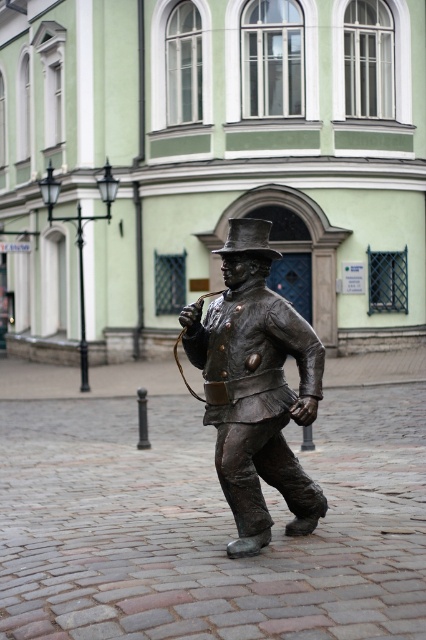
Is point (245, 506) farther from viewer compared to point (229, 241)?

No, it is in front of (229, 241).

Can you confirm if bronze statue at center is bigger than shiny bronze hat at center?

Actually, bronze statue at center might be smaller than shiny bronze hat at center.

What do you see at coordinates (256, 387) in the screenshot? I see `bronze statue at center` at bounding box center [256, 387].

Locate an element on the screen. The image size is (426, 640). bronze statue at center is located at coordinates (256, 387).